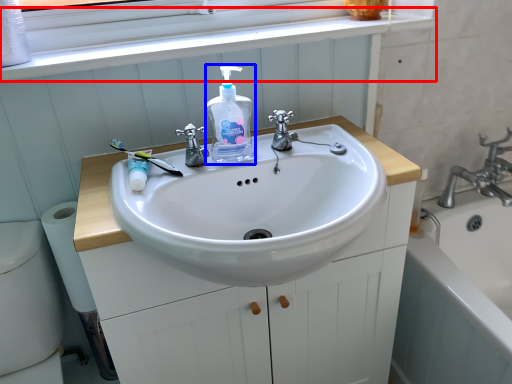
Question: Among these objects, which one is nearest to the camera, window frame (highlighted by a red box) or cleaning product (highlighted by a blue box)?

Choices:
 (A) window frame
 (B) cleaning product

Answer: (B)